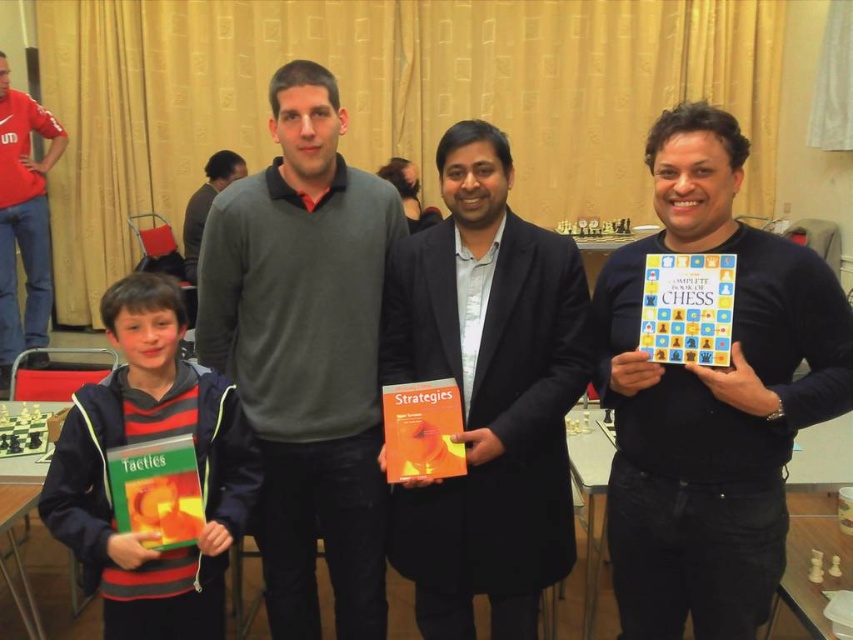
Does striped fabric jacket at lower left appear on the right side of orange matte strategies book at center?

In fact, striped fabric jacket at lower left is to the left of orange matte strategies book at center.

Based on the photo, who is more forward, (138, 560) or (439, 394)?

Positioned in front is point (138, 560).

The width and height of the screenshot is (853, 640). In order to click on striped fabric jacket at lower left in this screenshot , I will do pyautogui.click(x=149, y=440).

Is point (244, 432) less distant than point (142, 445)?

No, it is behind (142, 445).

Is striped fabric jacket at lower left to the right of hardcover tactics book at lower left from the viewer's perspective?

No, striped fabric jacket at lower left is not to the right of hardcover tactics book at lower left.

Where is `striped fabric jacket at lower left`? Image resolution: width=853 pixels, height=640 pixels. striped fabric jacket at lower left is located at coordinates (149, 440).

Find the location of a particular element. The width and height of the screenshot is (853, 640). striped fabric jacket at lower left is located at coordinates (149, 440).

Does black matte book at center have a greater width compared to orange matte strategies book at center?

Correct, the width of black matte book at center exceeds that of orange matte strategies book at center.

Consider the image. Between black matte book at center and orange matte strategies book at center, which one appears on the left side from the viewer's perspective?

orange matte strategies book at center is more to the left.

Is point (723, 157) positioned in front of point (422, 413)?

Yes, point (723, 157) is in front of point (422, 413).

Where is `black matte book at center`? black matte book at center is located at coordinates (711, 397).